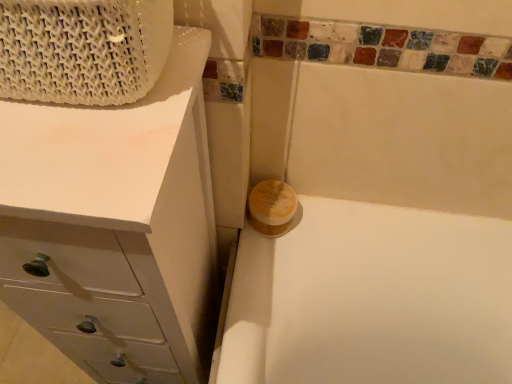
Identify the location of vacant area that is in front of white woven basket at upper left. (72, 158).